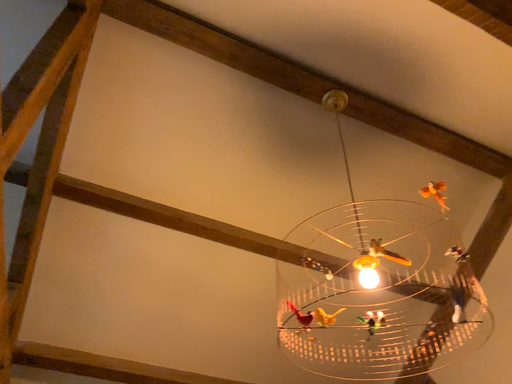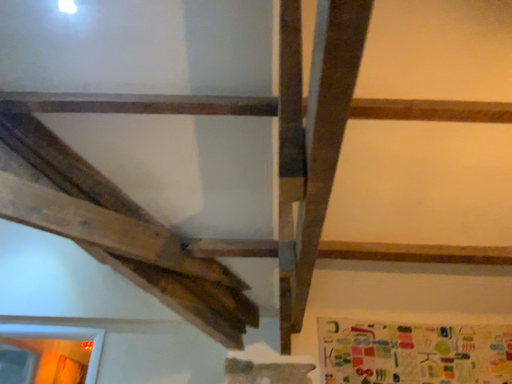
Question: How did the camera likely rotate when shooting the video?

Choices:
 (A) rotated upward
 (B) rotated downward

Answer: (B)